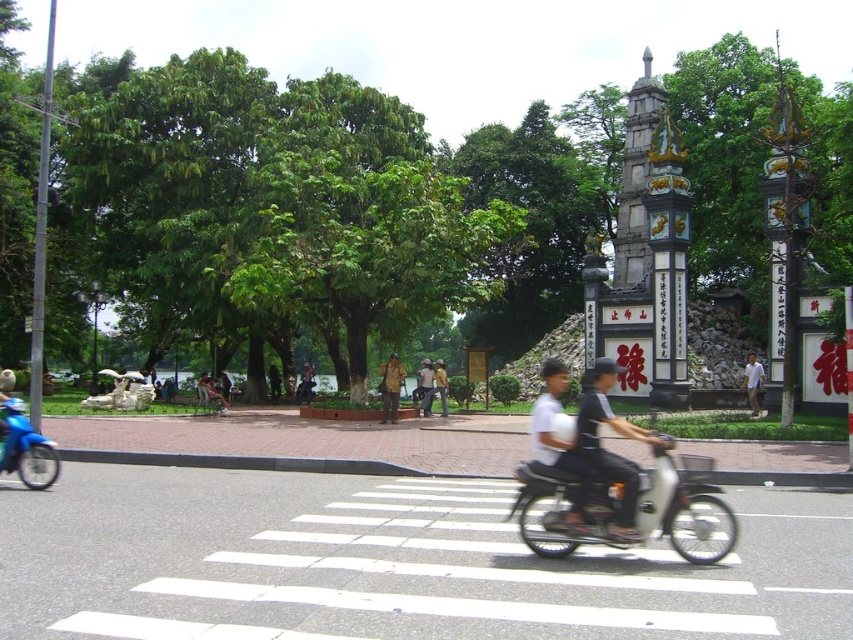
Question: Is the position of dark gray fabric shirt at center less distant than that of dark blue jeans at center?

Choices:
 (A) no
 (B) yes

Answer: (B)

Question: Is dark gray fabric shirt at center to the left of white matte helmet at upper center from the viewer's perspective?

Choices:
 (A) no
 (B) yes

Answer: (A)

Question: Estimate the real-world distances between objects in this image. Which object is closer to the white matte helmet at upper center?

Choices:
 (A) dark gray fabric shirt at center
 (B) yellow fabric shirt at center

Answer: (A)

Question: Is white cotton shirt at center above yellow fabric shirt at center?

Choices:
 (A) yes
 (B) no

Answer: (A)

Question: Which object appears farthest from the camera in this image?

Choices:
 (A) white matte helmet at upper center
 (B) khaki fabric pants at center

Answer: (B)

Question: Based on their relative distances, which object is nearer to the khaki fabric pants at center?

Choices:
 (A) dark blue jeans at center
 (B) dark brown leather jacket at center
 (C) white matte helmet at upper center

Answer: (A)